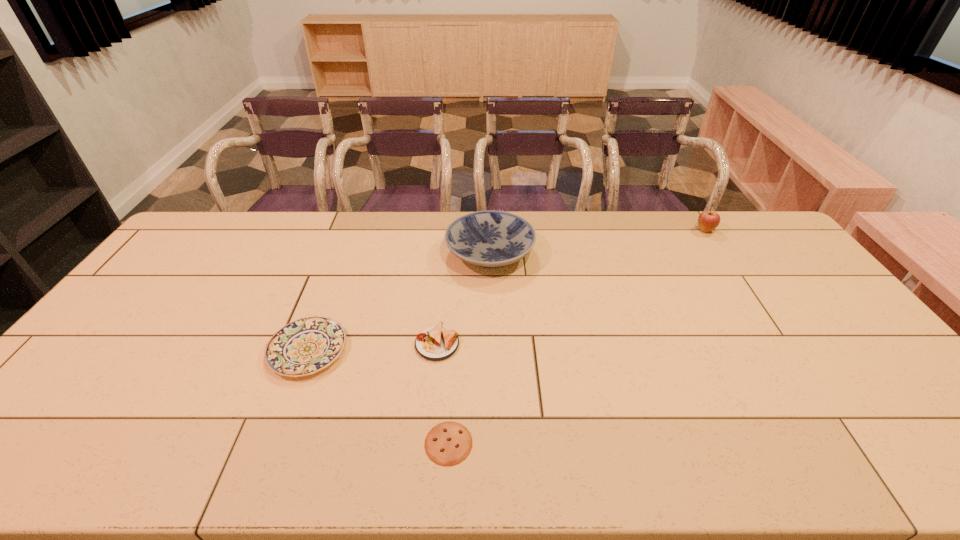
Point out which object is positioned as the nearest to the shorter plate. Please provide its 2D coordinates. Your answer should be formatted as a tuple, i.e. [(x, y)], where the tuple contains the x and y coordinates of a point satisfying the conditions above.

[(435, 343)]

Identify which object is the second closest to the taller plate. Please provide its 2D coordinates. Your answer should be formatted as a tuple, i.e. [(x, y)], where the tuple contains the x and y coordinates of a point satisfying the conditions above.

[(305, 346)]

Identify the location of vacant space that satisfies the following two spatial constraints: 1. on the back side of the nearest object; 2. on the right side of the rightmost object. Image resolution: width=960 pixels, height=540 pixels. (461, 230).

The height and width of the screenshot is (540, 960). I want to click on blank space that satisfies the following two spatial constraints: 1. on the back side of the sandwich; 2. on the right side of the fourth tallest object, so click(x=310, y=344).